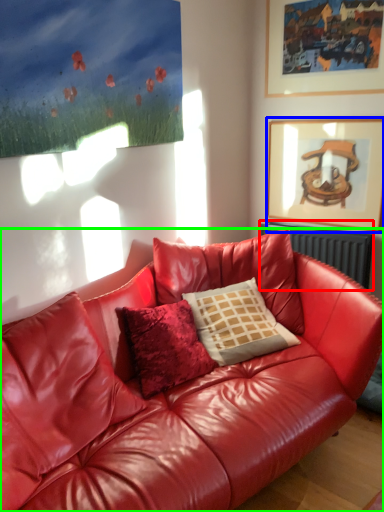
Question: Which is nearer to the radiator (highlighted by a red box)? picture frame (highlighted by a blue box) or studio couch (highlighted by a green box).

Choices:
 (A) picture frame
 (B) studio couch

Answer: (A)